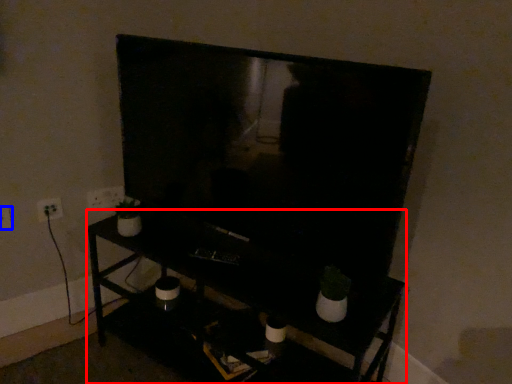
Question: Which of the following is the closest to the observer, furniture (highlighted by a red box) or electric outlet (highlighted by a blue box)?

Choices:
 (A) furniture
 (B) electric outlet

Answer: (A)